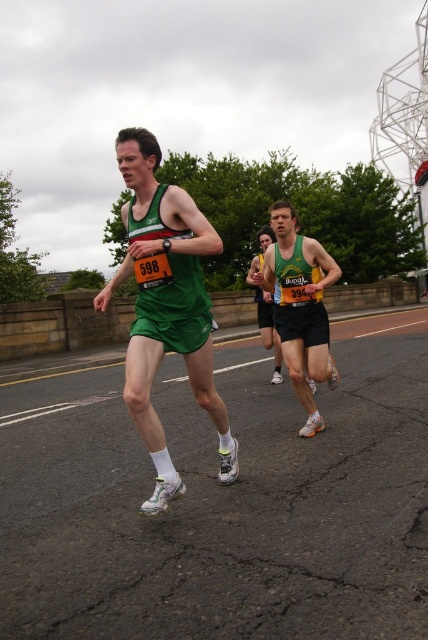
The width and height of the screenshot is (428, 640). I want to click on green fabric tank top at center, so click(166, 305).

Does point (143, 353) lie in front of point (321, 349)?

Yes, point (143, 353) is in front of point (321, 349).

Where is `green fabric tank top at center`? green fabric tank top at center is located at coordinates (166, 305).